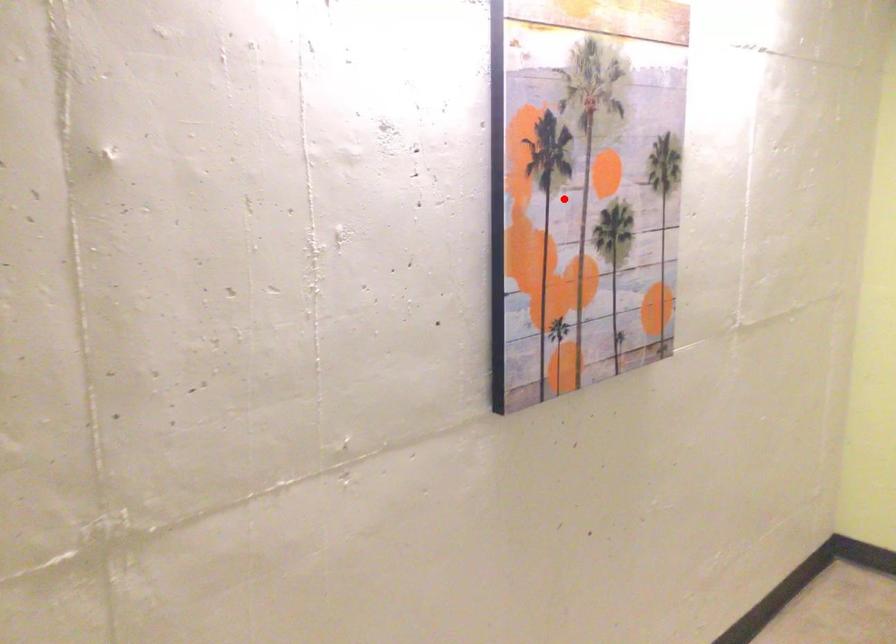
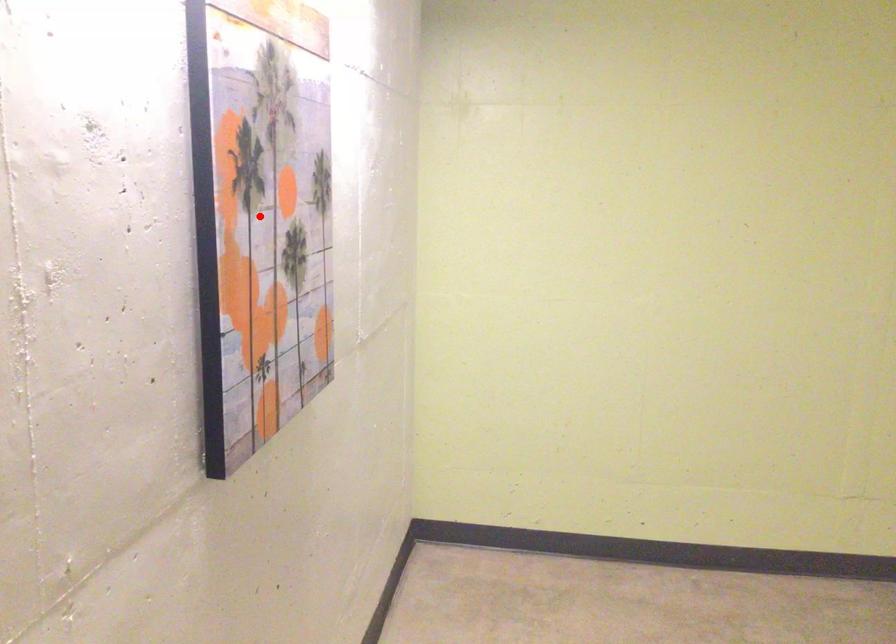
I am providing you with two images of the same scene from different viewpoints. A red point is marked on the first image and another point is marked on the second image. Is the marked point in image1 the same physical position as the marked point in image2?

Yes